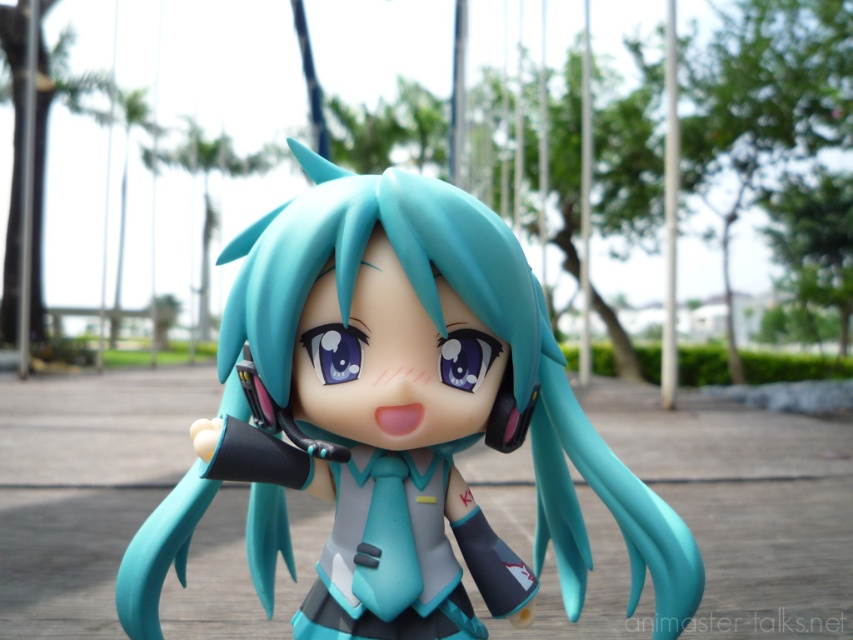
You are a collector looking to display the matte plastic figure at center in your collection. You notice that the figure is positioned at point (444, 337) in the image. If you want to place it on a shelf that requires the figure to be centered exactly at 0.5, 0.5, how far off is the current position from the desired center?

The point (444, 337) is slightly to the right and slightly above the desired center 0.5, 0.5. The horizontal distance is 0.027 units to the right, and the vertical distance is 0.022 units above.

You are a student who needs to place a matte plastic figure at center and a matte plastic school uniform at center on a desk. The desk is only 8 centimeters wide. Can both items fit side by side without overlapping?

The matte plastic figure at center is 8.27 centimeters away from matte plastic school uniform at center, which means they cannot fit side by side on an 8 cm desk without overlapping since the distance between them exceeds the desk width.

You are a student trying to find your school uniform in a cluttered locker. You see the matte plastic figure at center and the matte plastic school uniform at center. Which object is closer to the left side of the locker?

The matte plastic figure at center is positioned on the left side of the matte plastic school uniform at center, so the matte plastic figure at center is closer to the left side of the locker.